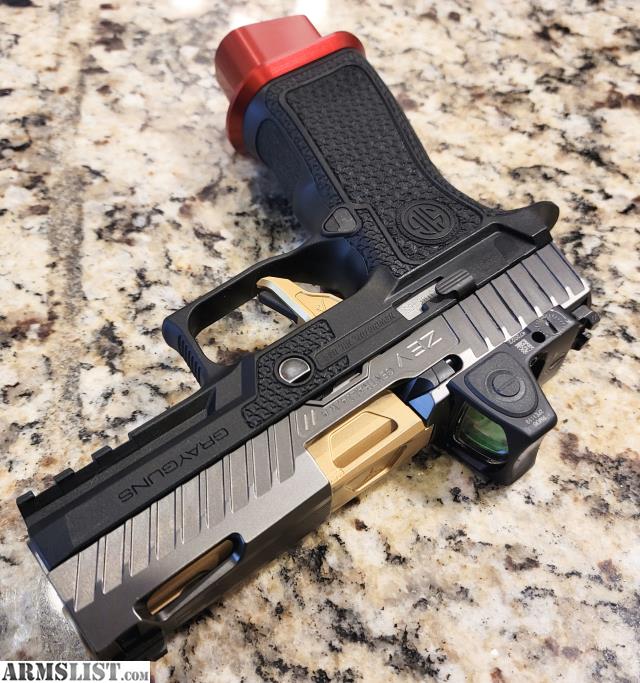
Identify the location of streak of grime on counter. This screenshot has height=683, width=640. (67, 250).